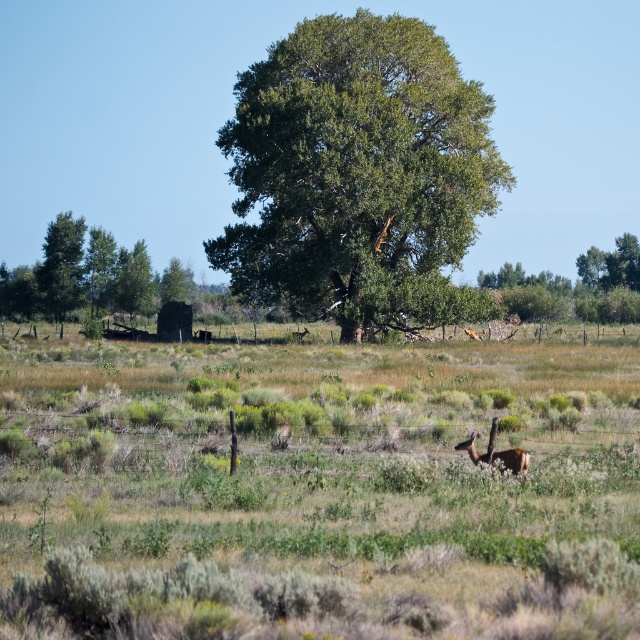
You are standing at the barbed wire fence in the foreground of the image. You want to walk towards the green leafy oak tree at center. In which direction should you move relative to the fence?

The green leafy oak tree at center is located at point coordinates that are to the upper part of the image. Since you are at the fence in the foreground, which is at the lower part, you should move forward towards the center to reach it.

You are standing at the lower edge of the image and looking towards the green leafy tree at upper center. Based on its position coordinates, how far up from the bottom of the image is the tree located?

The green leafy tree at upper center is located at 0.900 on the vertical axis, meaning it is 90.0 percent of the image height from the bottom edge.

You are standing in front of the barbed wire fence in the scene. You notice two green leafy trees in the distance. Which tree, the green leafy tree at upper center or the green leafy tree at upper left, is positioned lower in the image?

The green leafy tree at upper center is positioned lower in the image than the green leafy tree at upper left.